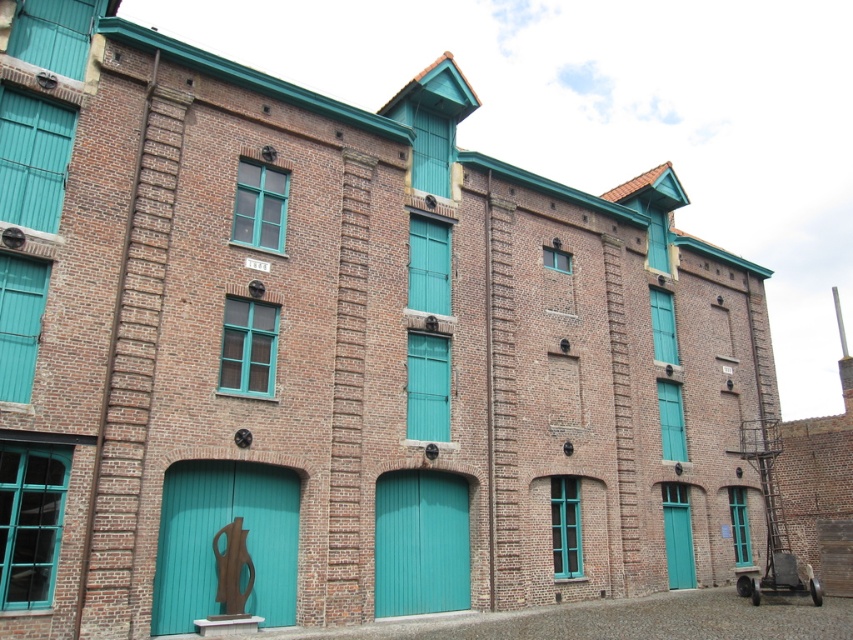
You are standing in front of the building and notice two points marked on the facade. The first point is at coordinate point (440, 508) and the second is at point (677, 486). If you were to walk towards the building, which point would appear closer to you?

Point (440, 508) is closer to the camera than point (677, 486), so it would appear closer to you when you walk towards the building.